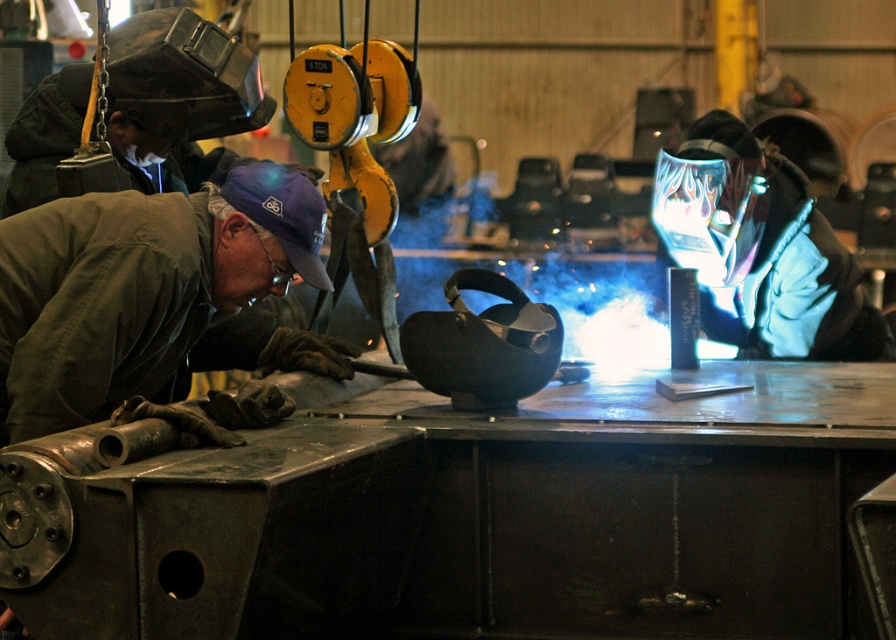
Does point (110, 394) come closer to viewer compared to point (866, 346)?

Yes.

Between point (196, 236) and point (829, 324), which one is positioned behind?

Positioned behind is point (829, 324).

At what (x,y) coordinates should I click in order to perform the action: click on green matte jacket at left. Please return your answer as a coordinate pair (x, y). The width and height of the screenshot is (896, 640). Looking at the image, I should click on (151, 294).